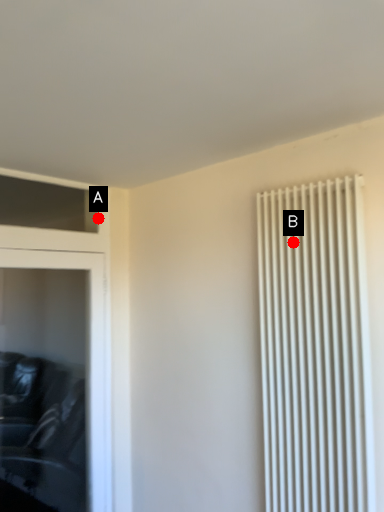
Question: Two points are circled on the image, labeled by A and B beside each circle. Which point is further to the camera?

Choices:
 (A) A is further
 (B) B is further

Answer: (A)